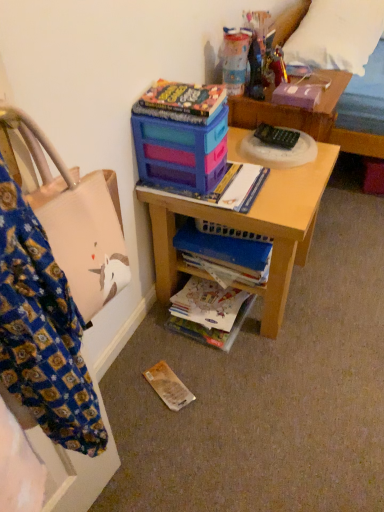
The width and height of the screenshot is (384, 512). Find the location of `vacant space that's between matte paper book at lower center, which is the 2th book from top to bottom, and brown paper book at lower center, acting as the second paperback book starting from the back`. vacant space that's between matte paper book at lower center, which is the 2th book from top to bottom, and brown paper book at lower center, acting as the second paperback book starting from the back is located at coordinates (177, 358).